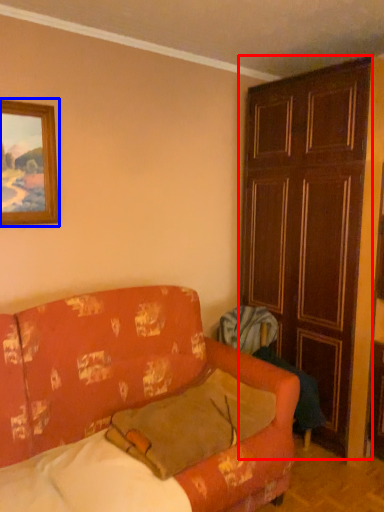
Question: Which of the following is the closest to the observer, door (highlighted by a red box) or picture frame (highlighted by a blue box)?

Choices:
 (A) door
 (B) picture frame

Answer: (B)